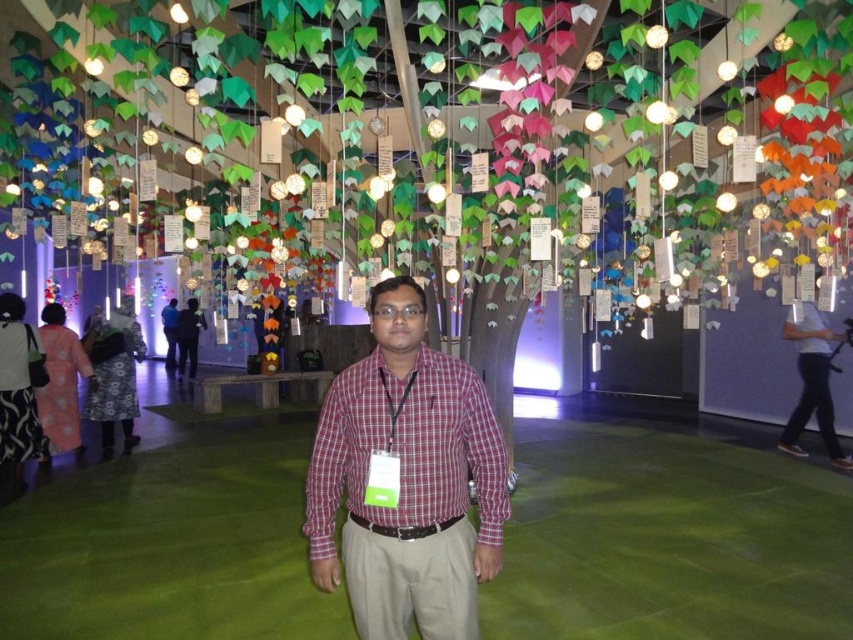
Question: Which object appears farthest from the camera in this image?

Choices:
 (A) matte black shirt at center
 (B) white cotton shirt at right

Answer: (A)

Question: Which point is closer to the camera?

Choices:
 (A) (793, 339)
 (B) (173, 340)
 (C) (439, 442)

Answer: (C)

Question: From the image, what is the correct spatial relationship of white cotton shirt at right in relation to plaid shirt at center?

Choices:
 (A) right
 (B) left

Answer: (A)

Question: Considering the relative positions of plaid cotton shirt at center and matte black shirt at center in the image provided, where is plaid cotton shirt at center located with respect to matte black shirt at center?

Choices:
 (A) left
 (B) right

Answer: (B)

Question: Is white cotton shirt at right above plaid shirt at center?

Choices:
 (A) no
 (B) yes

Answer: (A)

Question: Estimate the real-world distances between objects in this image. Which object is farther from the white cotton shirt at right?

Choices:
 (A) plaid shirt at center
 (B) matte black shirt at center
 (C) plaid cotton shirt at center

Answer: (A)